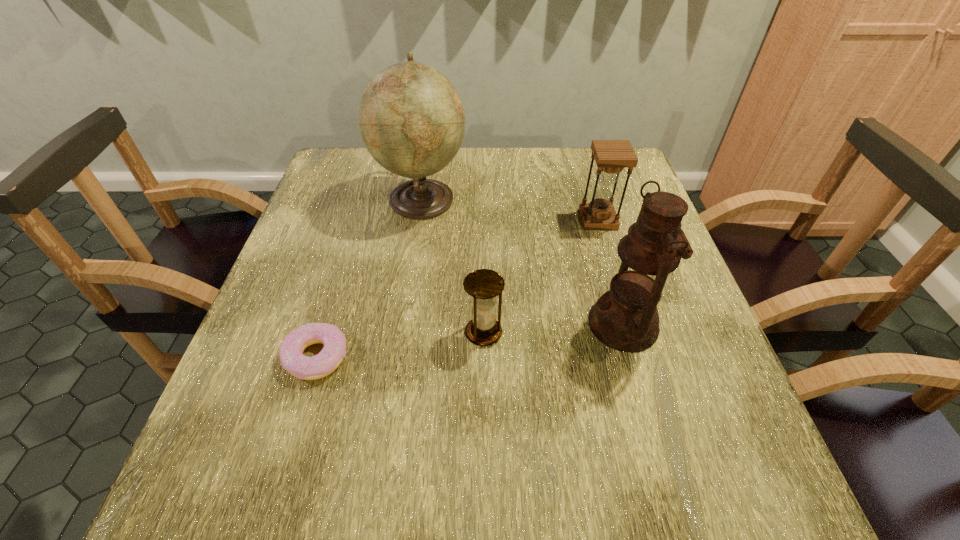
The width and height of the screenshot is (960, 540). Find the location of `free location at the near right corner`. free location at the near right corner is located at coordinates (x=722, y=500).

At what (x,y) coordinates should I click in order to perform the action: click on vacant point located between the tallest object and the second shortest object. Please return your answer as a coordinate pair (x, y). Image resolution: width=960 pixels, height=540 pixels. Looking at the image, I should click on (453, 266).

At what (x,y) coordinates should I click in order to perform the action: click on free spot between the third object from right to left and the shortest object. Please return your answer as a coordinate pair (x, y). This screenshot has width=960, height=540. Looking at the image, I should click on (400, 345).

Locate an element on the screen. The width and height of the screenshot is (960, 540). unoccupied area between the tallest object and the taller hourglass is located at coordinates (510, 209).

At what (x,y) coordinates should I click in order to perform the action: click on free space between the nearer hourglass and the third shortest object. Please return your answer as a coordinate pair (x, y). Looking at the image, I should click on (540, 276).

This screenshot has width=960, height=540. I want to click on free space between the second shortest object and the third tallest object, so click(540, 276).

Where is `free spot between the shortest object and the globe`? This screenshot has width=960, height=540. free spot between the shortest object and the globe is located at coordinates (370, 278).

This screenshot has height=540, width=960. I want to click on vacant region between the second shortest object and the right hourglass, so click(x=540, y=276).

What are the coordinates of `free area in between the shortest object and the nearer hourglass` in the screenshot? It's located at (400, 345).

In order to click on empty space between the doughnut and the globe in this screenshot , I will do `click(370, 278)`.